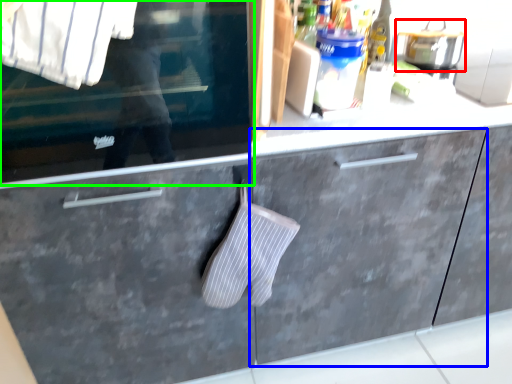
Question: Which object is positioned farthest from appliance (highlighted by a red box)? Select from cabinetry (highlighted by a blue box) and window (highlighted by a green box).

Choices:
 (A) cabinetry
 (B) window

Answer: (B)